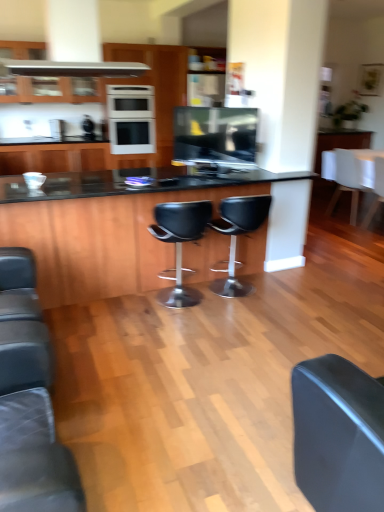
Image resolution: width=384 pixels, height=512 pixels. I want to click on vacant area that is in front of black leather stool at center, arranged as the 1th chair when viewed from the front, so click(178, 333).